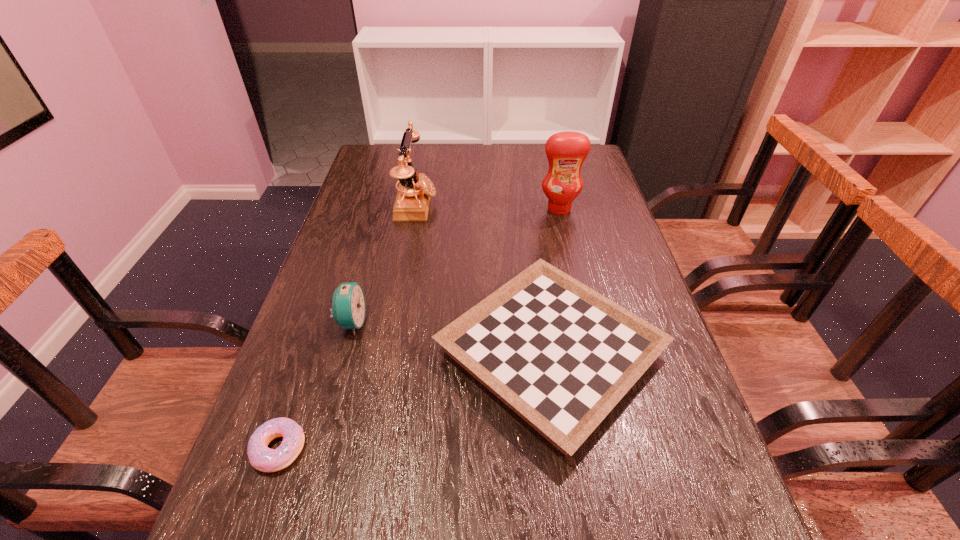
The height and width of the screenshot is (540, 960). I want to click on telephone located at the left edge, so click(412, 202).

This screenshot has height=540, width=960. I want to click on alarm clock present at the left edge, so click(x=348, y=308).

The image size is (960, 540). Identify the location of doughnut located in the left edge section of the desktop. (262, 458).

The image size is (960, 540). Find the location of `condiment located in the right edge section of the desktop`. condiment located in the right edge section of the desktop is located at coordinates (566, 151).

I want to click on checkerboard that is at the right edge, so click(561, 355).

Image resolution: width=960 pixels, height=540 pixels. In order to click on vacant space at the far edge in this screenshot , I will do `click(454, 171)`.

In the image, there is a desktop. Identify the location of blank space at the left edge. (327, 351).

Where is `vacant space at the right edge of the desktop`? The height and width of the screenshot is (540, 960). vacant space at the right edge of the desktop is located at coordinates (703, 468).

In the image, there is a desktop. Identify the location of vacant space at the far left corner. (397, 163).

What are the coordinates of `free space between the doughnut and the alarm clock` in the screenshot? It's located at (315, 386).